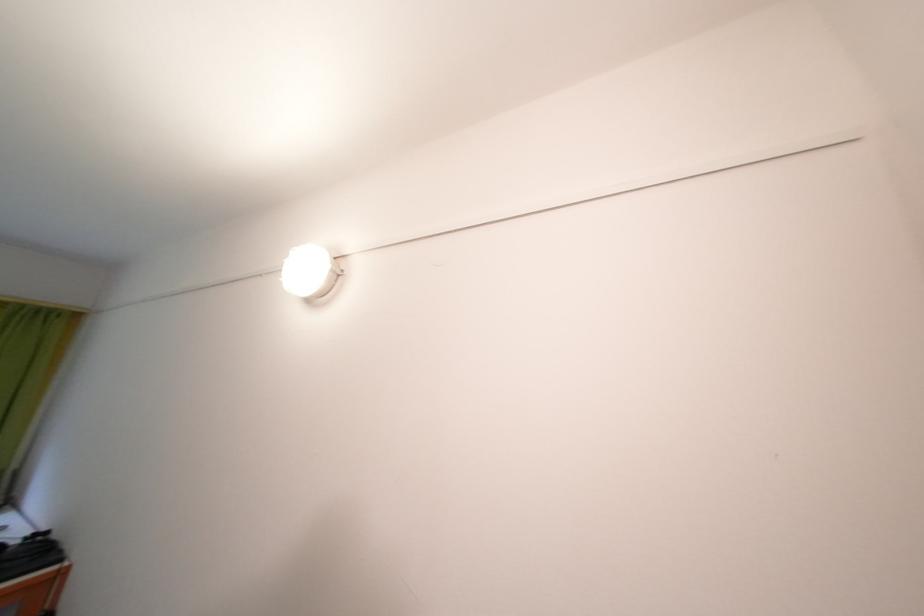
Where would you twist the round light cover? Please return your answer as a coordinate pair (x, y).

(310, 272)